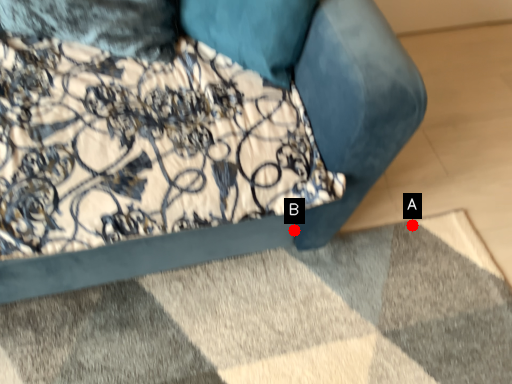
Question: Two points are circled on the image, labeled by A and B beside each circle. Which point appears farthest from the camera in this image?

Choices:
 (A) A is further
 (B) B is further

Answer: (A)